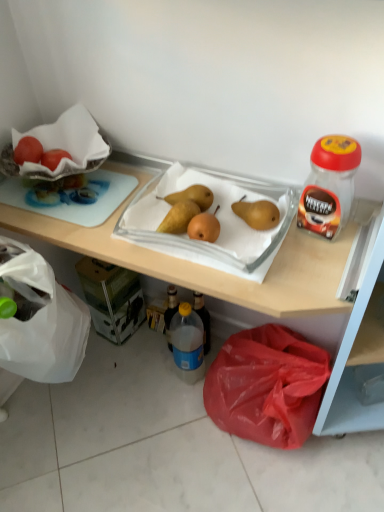
Identify the location of vacant space in front of red plastic bag at lower center. The image size is (384, 512). (275, 478).